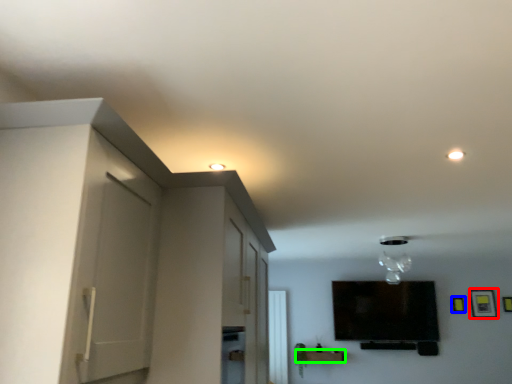
Question: Estimate the real-world distances between objects in this image. Which object is closer to picture frame (highlighted by a red box), picture frame (highlighted by a blue box) or furniture (highlighted by a green box)?

Choices:
 (A) picture frame
 (B) furniture

Answer: (A)